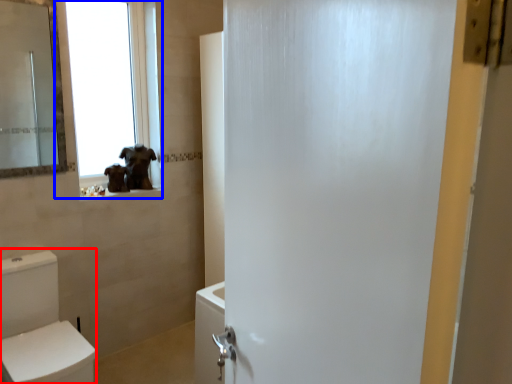
Question: Which object is further to the camera taking this photo, toilet bowl (highlighted by a red box) or window (highlighted by a blue box)?

Choices:
 (A) toilet bowl
 (B) window

Answer: (B)